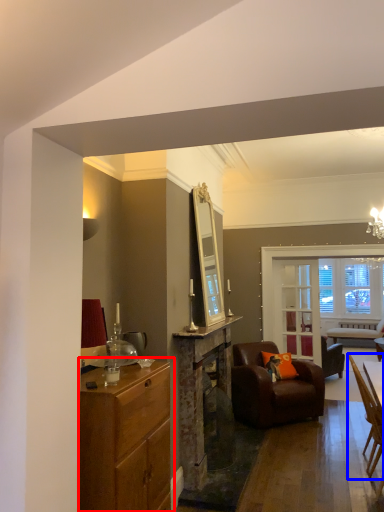
Question: Which object appears closest to the camera in this image, cabinetry (highlighted by a red box) or chair (highlighted by a blue box)?

Choices:
 (A) cabinetry
 (B) chair

Answer: (A)